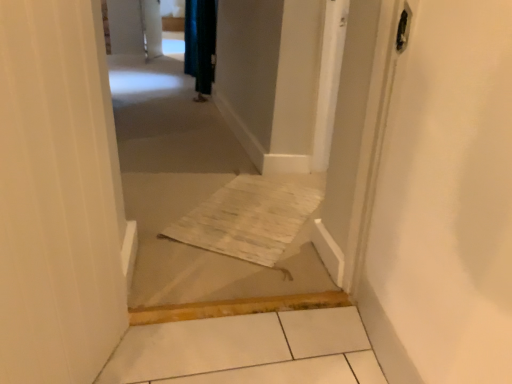
Question: Is velvet dark green curtain at upper center smaller than neutral carpet at center?

Choices:
 (A) yes
 (B) no

Answer: (A)

Question: From a real-world perspective, is velvet dark green curtain at upper center beneath neutral carpet at center?

Choices:
 (A) yes
 (B) no

Answer: (B)

Question: Is velvet dark green curtain at upper center looking in the opposite direction of neutral carpet at center?

Choices:
 (A) yes
 (B) no

Answer: (B)

Question: Would you say neutral carpet at center is part of velvet dark green curtain at upper center's contents?

Choices:
 (A) yes
 (B) no

Answer: (B)

Question: Could you tell me if velvet dark green curtain at upper center is facing neutral carpet at center?

Choices:
 (A) no
 (B) yes

Answer: (A)

Question: Considering the relative positions of velvet dark green curtain at upper center and neutral carpet at center in the image provided, is velvet dark green curtain at upper center to the right of neutral carpet at center from the viewer's perspective?

Choices:
 (A) yes
 (B) no

Answer: (B)

Question: Is neutral carpet at center positioned with its back to velvet dark green curtain at upper center?

Choices:
 (A) yes
 (B) no

Answer: (A)

Question: Is neutral carpet at center closer to the viewer compared to velvet dark green curtain at upper center?

Choices:
 (A) yes
 (B) no

Answer: (A)

Question: Does neutral carpet at center have a smaller size compared to velvet dark green curtain at upper center?

Choices:
 (A) yes
 (B) no

Answer: (B)

Question: Can you confirm if neutral carpet at center is positioned to the left of velvet dark green curtain at upper center?

Choices:
 (A) no
 (B) yes

Answer: (A)

Question: Would you consider neutral carpet at center to be distant from velvet dark green curtain at upper center?

Choices:
 (A) yes
 (B) no

Answer: (A)

Question: From a real-world perspective, does neutral carpet at center stand above velvet dark green curtain at upper center?

Choices:
 (A) no
 (B) yes

Answer: (A)

Question: In terms of size, does velvet dark green curtain at upper center appear bigger or smaller than neutral carpet at center?

Choices:
 (A) small
 (B) big

Answer: (A)